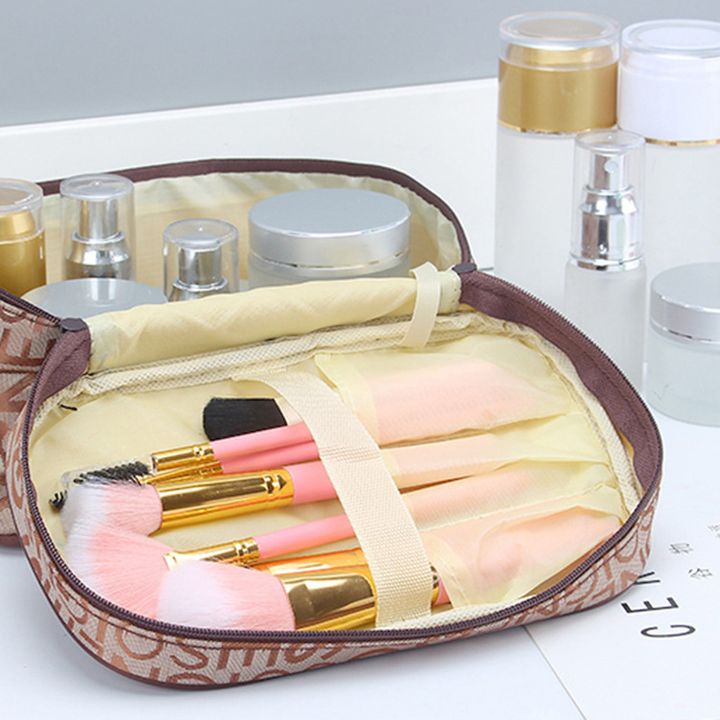
I want to click on bottles, so click(109, 220), click(202, 252), click(623, 186), click(16, 230), click(566, 120), click(670, 150).